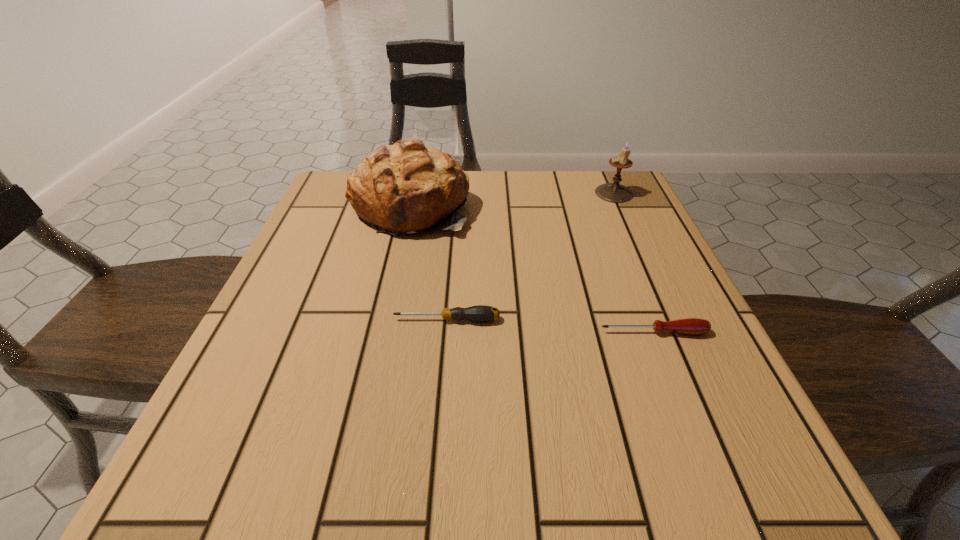
Image resolution: width=960 pixels, height=540 pixels. I want to click on vacant area that lies between the candle holder and the bread, so click(x=513, y=200).

The height and width of the screenshot is (540, 960). What are the coordinates of `vacant space that is in between the right screwdriver and the farther screwdriver` in the screenshot? It's located at (550, 326).

Choose which object is the nearest neighbor to the candle holder. Please provide its 2D coordinates. Your answer should be formatted as a tuple, i.e. [(x, y)], where the tuple contains the x and y coordinates of a point satisfying the conditions above.

[(406, 187)]

Find the location of `the third closest object to the bread`. the third closest object to the bread is located at coordinates (692, 326).

The width and height of the screenshot is (960, 540). I want to click on vacant position in the image that satisfies the following two spatial constraints: 1. on the front side of the second nearest object; 2. on the right side of the bread, so click(x=386, y=320).